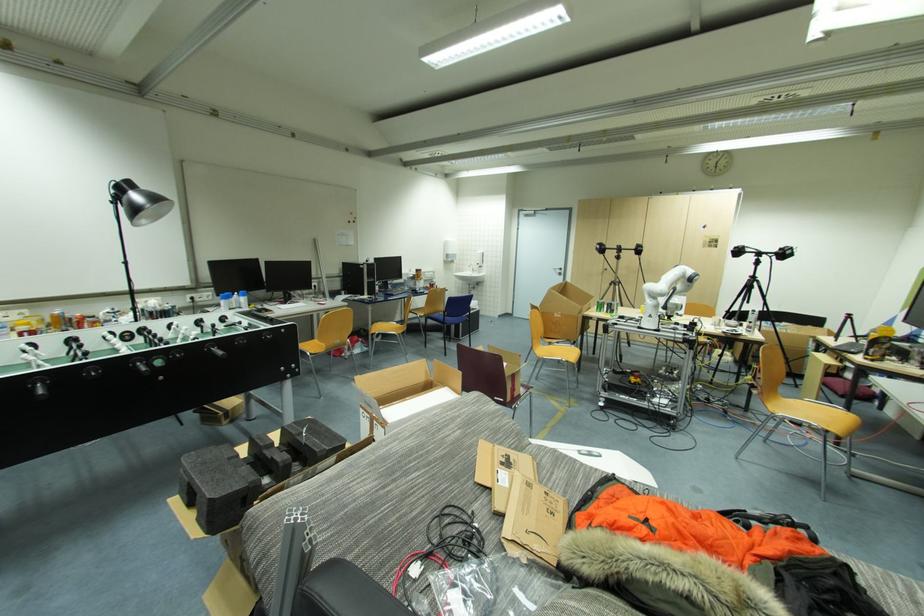
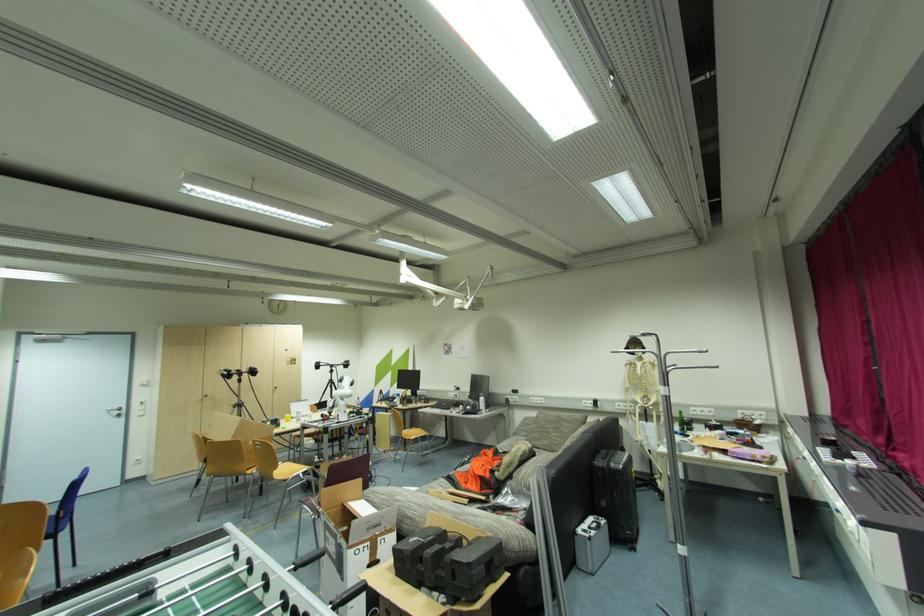
Where in the second image is the point corresponding to (x=563, y=272) from the first image?

(122, 413)